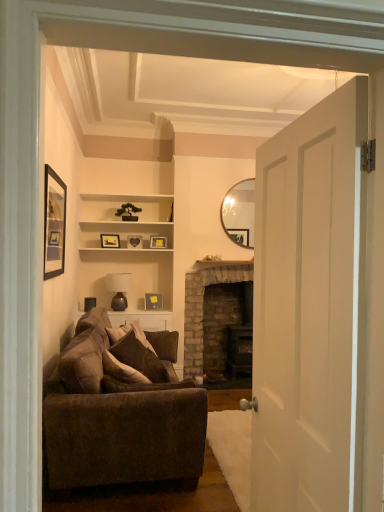
Question: From the image's perspective, is matte gold picture frame at upper center, marked as the 5th picture frame in a front-to-back arrangement, located above or below matte black picture frame at upper center, marked as the fourth picture frame in a back-to-front arrangement?

Choices:
 (A) below
 (B) above

Answer: (A)

Question: Considering the positions of matte gold picture frame at upper center, which is the 1th picture frame from back to front, and matte black picture frame at upper center, which appears as the 2th picture frame when viewed from the front, in the image, is matte gold picture frame at upper center, which is the 1th picture frame from back to front, taller or shorter than matte black picture frame at upper center, which appears as the 2th picture frame when viewed from the front,?

Choices:
 (A) tall
 (B) short

Answer: (A)

Question: Based on their relative distances, which object is nearer to the white wood shelf at center?

Choices:
 (A) matte black picture frame at upper center, which is the third picture frame in bottom-to-top order
 (B) brick fireplace at center
 (C) black matte picture frame at upper left, the fifth picture frame in the bottom-to-top sequence
 (D) brown fabric couch at lower left
 (E) wooden heart at center, which is counted as the fourth picture frame, starting from the bottom

Answer: (A)

Question: Which object is the closest to the brown fabric couch at lower left?

Choices:
 (A) brick fireplace at center
 (B) matte brown lamp at center
 (C) white matte door at center
 (D) matte yellow picture frame at center, the 4th picture frame from the front
 (E) black matte picture frame at upper left, acting as the 1th picture frame starting from the front

Answer: (E)